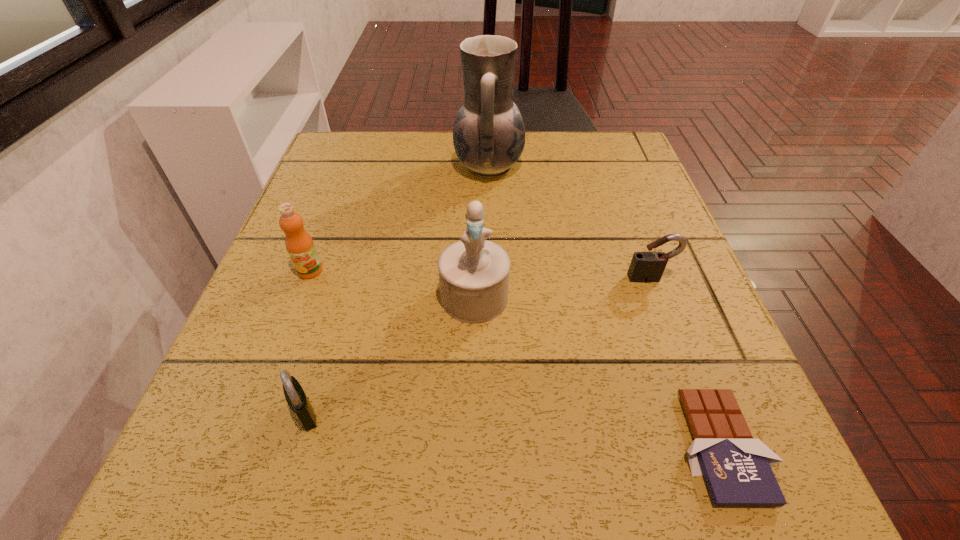
Where is `object identified as the fifth closest to the second object from left to right`? This screenshot has height=540, width=960. object identified as the fifth closest to the second object from left to right is located at coordinates (646, 267).

This screenshot has width=960, height=540. I want to click on vacant space that satisfies the following two spatial constraints: 1. on the front-facing side of the tallest object; 2. at the beak of the second tallest object, so click(x=492, y=297).

Locate an element on the screen. This screenshot has height=540, width=960. vacant space that satisfies the following two spatial constraints: 1. on the front label of the second object from left to right; 2. on the right side of the fourth shortest object is located at coordinates (256, 413).

Locate an element on the screen. Image resolution: width=960 pixels, height=540 pixels. vacant area in the image that satisfies the following two spatial constraints: 1. on the front label of the fourth shortest object; 2. on the left side of the chocolate bar is located at coordinates (244, 446).

This screenshot has width=960, height=540. Identify the location of vacant space that satisfies the following two spatial constraints: 1. at the beak of the fifth shortest object; 2. on the left side of the chocolate bar. (472, 446).

The image size is (960, 540). I want to click on vacant area that satisfies the following two spatial constraints: 1. on the front-facing side of the pitcher; 2. at the beak of the fifth shortest object, so click(492, 297).

Locate an element on the screen. vacant region that satisfies the following two spatial constraints: 1. on the front-facing side of the tallest object; 2. at the beak of the second tallest object is located at coordinates (492, 297).

Where is `vacant point that satisfies the following two spatial constraints: 1. on the front label of the orange juice; 2. on the left side of the chocolate bar`? The image size is (960, 540). vacant point that satisfies the following two spatial constraints: 1. on the front label of the orange juice; 2. on the left side of the chocolate bar is located at coordinates (244, 446).